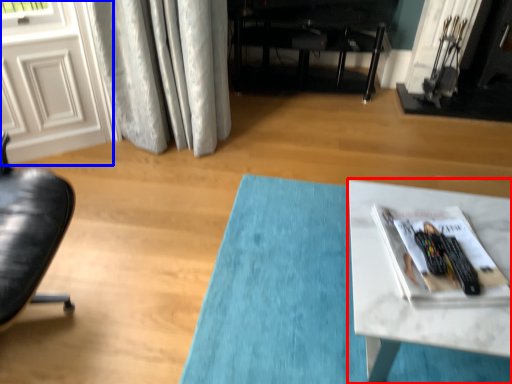
Question: Which object appears farthest to the camera in this image, table (highlighted by a red box) or screen door (highlighted by a blue box)?

Choices:
 (A) table
 (B) screen door

Answer: (B)